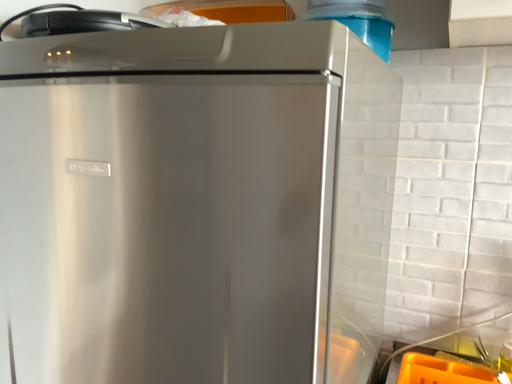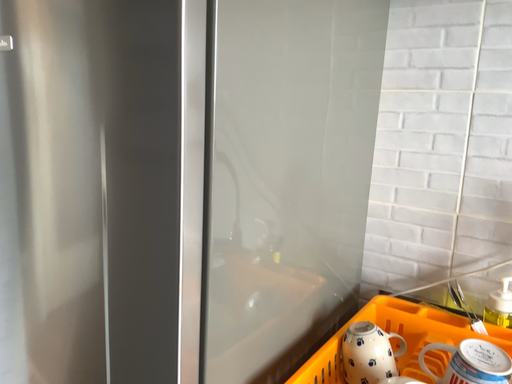
Question: How did the camera likely rotate when shooting the video?

Choices:
 (A) rotated right
 (B) rotated left

Answer: (B)